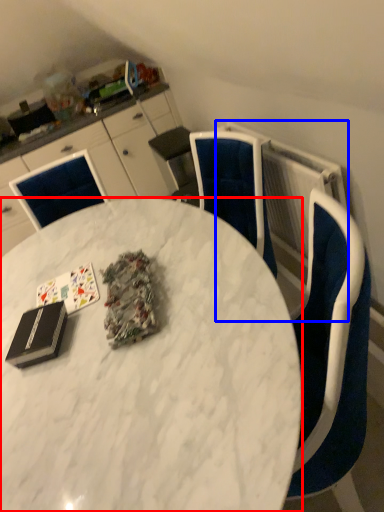
Question: Which point is further to the camera, desk (highlighted by a red box) or radiator (highlighted by a blue box)?

Choices:
 (A) desk
 (B) radiator

Answer: (B)